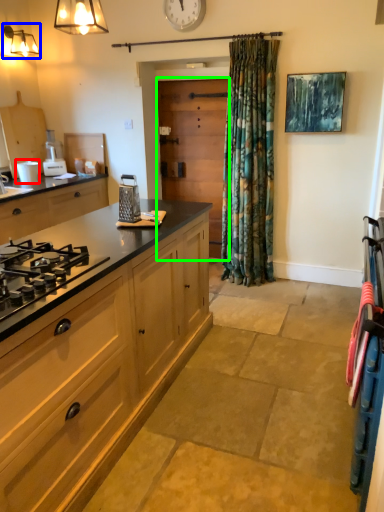
Question: Considering the real-world distances, which object is closest to appliance (highlighted by a red box)? light fixture (highlighted by a blue box) or screen door (highlighted by a green box).

Choices:
 (A) light fixture
 (B) screen door

Answer: (A)